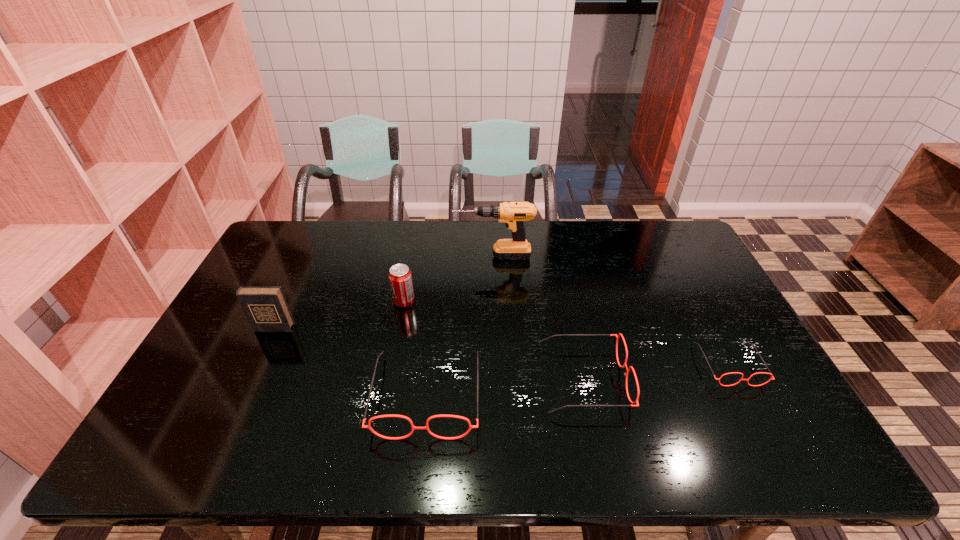
Please point a free position for a spectacles on the left. Please provide its 2D coordinates. Your answer should be formatted as a tuple, i.e. [(x, y)], where the tuple contains the x and y coordinates of a point satisfying the conditions above.

[(261, 410)]